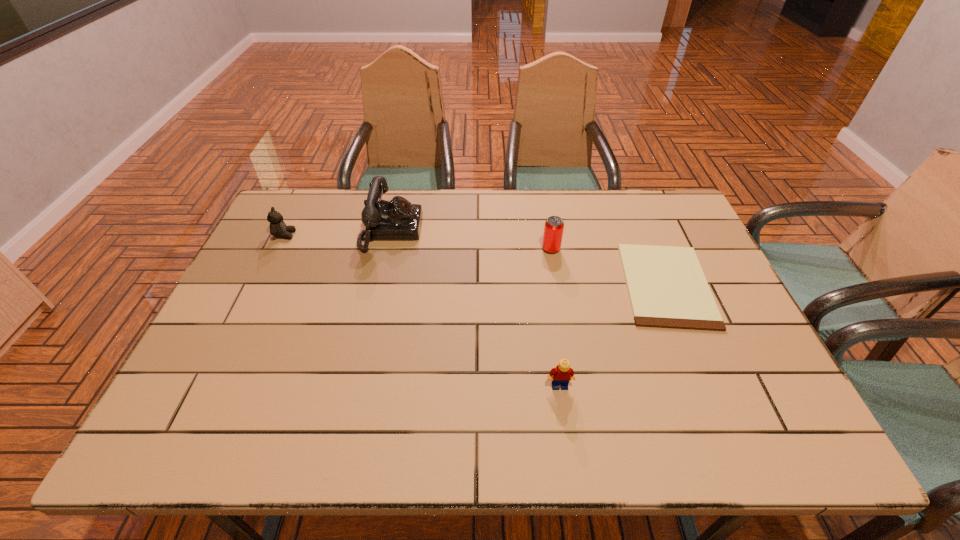
Locate an element on the screen. blank area at the right edge is located at coordinates (719, 305).

Where is `vacant area at the far left corner`? vacant area at the far left corner is located at coordinates 333,194.

Locate an element on the screen. This screenshot has width=960, height=540. vacant space at the far right corner of the desktop is located at coordinates (675, 205).

Locate an element on the screen. Image resolution: width=960 pixels, height=540 pixels. free spot at the near right corner of the desktop is located at coordinates (784, 449).

Locate an element on the screen. free spot between the shortest object and the nearest object is located at coordinates (612, 335).

Find the location of a particular element. free space between the clipboard and the tallest object is located at coordinates (529, 258).

The width and height of the screenshot is (960, 540). In order to click on free space between the nearest object and the clipboard in this screenshot , I will do `click(612, 335)`.

This screenshot has width=960, height=540. I want to click on vacant point located between the clipboard and the can, so click(609, 267).

Where is `unoccupied area between the teddy bear and the shortest object`? The height and width of the screenshot is (540, 960). unoccupied area between the teddy bear and the shortest object is located at coordinates (475, 260).

Image resolution: width=960 pixels, height=540 pixels. I want to click on empty space that is in between the can and the Lego, so tap(555, 318).